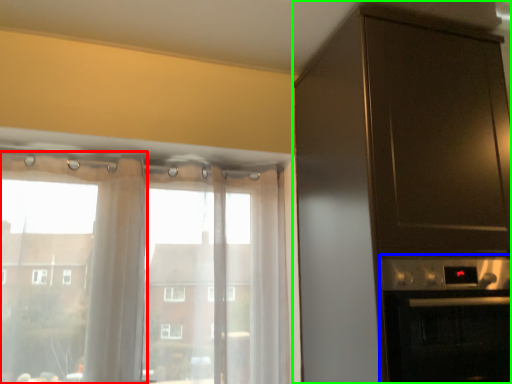
Question: Based on their relative distances, which object is farther from curtain (highlighted by a red box)? Choose from appliance (highlighted by a blue box) and cabinetry (highlighted by a green box).

Choices:
 (A) appliance
 (B) cabinetry

Answer: (A)